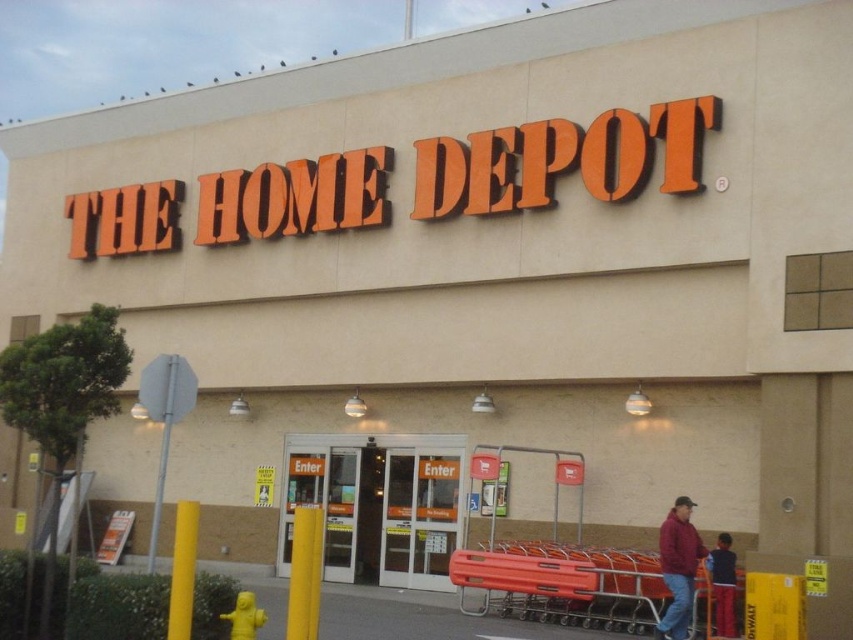
Question: Which object is closer to the camera taking this photo?

Choices:
 (A) dark blue jeans at lower right
 (B) clear glass doors at center

Answer: (A)

Question: Can you confirm if clear glass doors at center is thinner than maroon fabric jacket at lower right?

Choices:
 (A) yes
 (B) no

Answer: (B)

Question: Which point appears closest to the camera in this image?

Choices:
 (A) (662, 534)
 (B) (315, 472)

Answer: (A)

Question: Which point is closer to the camera taking this photo?

Choices:
 (A) (419, 509)
 (B) (683, 572)

Answer: (B)

Question: Can you confirm if clear glass doors at center is positioned below dark blue jeans at lower right?

Choices:
 (A) no
 (B) yes

Answer: (B)

Question: From the image, what is the correct spatial relationship of clear glass doors at center in relation to dark blue jeans at lower right?

Choices:
 (A) left
 (B) right

Answer: (A)